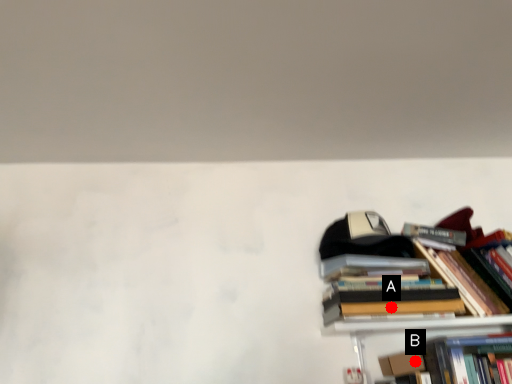
Question: Two points are circled on the image, labeled by A and B beside each circle. Which point is further to the camera?

Choices:
 (A) A is further
 (B) B is further

Answer: (B)